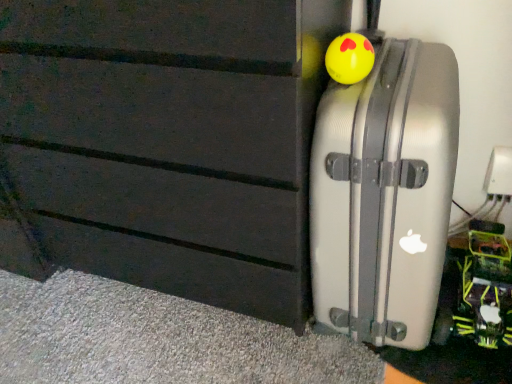
Question: Is yellow rubber ball at upper right, positioned as the second toy in right-to-left order, completely or partially inside neon green plastic toy at lower right, the first toy in the right-to-left sequence?

Choices:
 (A) no
 (B) yes

Answer: (A)

Question: Is neon green plastic toy at lower right, which ranks as the second toy in top-to-bottom order, outside yellow rubber ball at upper right, which appears as the 1th toy when viewed from the left?

Choices:
 (A) no
 (B) yes

Answer: (B)

Question: Considering the relative positions of neon green plastic toy at lower right, the second toy in the front-to-back sequence, and yellow rubber ball at upper right, positioned as the second toy in right-to-left order, in the image provided, is neon green plastic toy at lower right, the second toy in the front-to-back sequence, to the left of yellow rubber ball at upper right, positioned as the second toy in right-to-left order, from the viewer's perspective?

Choices:
 (A) yes
 (B) no

Answer: (B)

Question: From the image's perspective, is neon green plastic toy at lower right, which ranks as the second toy in top-to-bottom order, located above yellow rubber ball at upper right, which appears as the 1th toy when viewed from the front?

Choices:
 (A) yes
 (B) no

Answer: (B)

Question: Does neon green plastic toy at lower right, the second toy in the front-to-back sequence, turn towards yellow rubber ball at upper right, acting as the second toy starting from the bottom?

Choices:
 (A) yes
 (B) no

Answer: (B)

Question: Does neon green plastic toy at lower right, the second toy viewed from the left, have a lesser width compared to yellow rubber ball at upper right, which appears as the 1th toy when viewed from the left?

Choices:
 (A) no
 (B) yes

Answer: (A)

Question: Is yellow rubber ball at upper right, positioned as the second toy in right-to-left order, far from neon green plastic toy at lower right, the second toy viewed from the left?

Choices:
 (A) yes
 (B) no

Answer: (B)

Question: Is yellow rubber ball at upper right, the 1th toy positioned from the top, at the left side of neon green plastic toy at lower right, arranged as the 1th toy when ordered from the bottom?

Choices:
 (A) yes
 (B) no

Answer: (A)

Question: Is yellow rubber ball at upper right, the 1th toy positioned from the top, further to the viewer compared to neon green plastic toy at lower right, the second toy in the front-to-back sequence?

Choices:
 (A) no
 (B) yes

Answer: (A)

Question: Is the depth of yellow rubber ball at upper right, acting as the second toy starting from the bottom, less than that of neon green plastic toy at lower right, the second toy viewed from the left?

Choices:
 (A) yes
 (B) no

Answer: (A)

Question: Is yellow rubber ball at upper right, positioned as the second toy in right-to-left order, smaller than neon green plastic toy at lower right, arranged as the 1th toy when ordered from the bottom?

Choices:
 (A) no
 (B) yes

Answer: (B)

Question: Can you confirm if yellow rubber ball at upper right, the 2th toy when ordered from back to front, is bigger than neon green plastic toy at lower right, the first toy in the right-to-left sequence?

Choices:
 (A) no
 (B) yes

Answer: (A)

Question: Can you confirm if yellow rubber ball at upper right, positioned as the second toy in right-to-left order, is smaller than silver metallic suitcase at right?

Choices:
 (A) yes
 (B) no

Answer: (A)